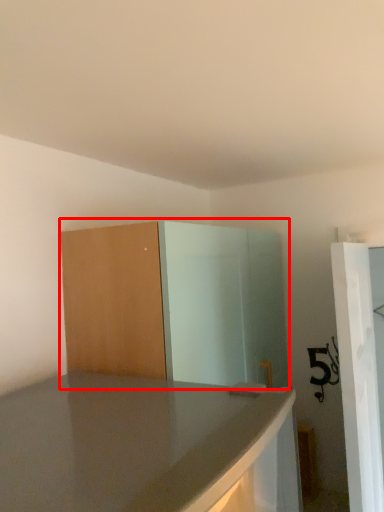
Question: In this image, where is dresser (annotated by the red box) located relative to screen door?

Choices:
 (A) left
 (B) right

Answer: (A)